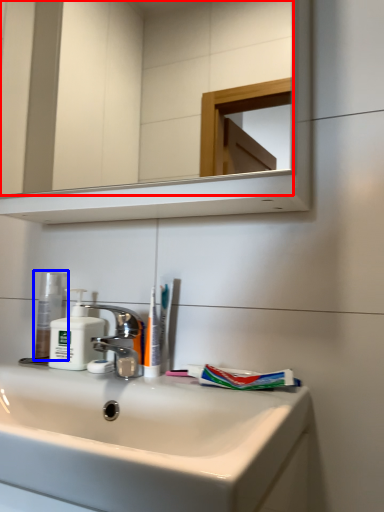
Question: Which object is closer to the camera taking this photo, mirror (highlighted by a red box) or toiletry (highlighted by a blue box)?

Choices:
 (A) mirror
 (B) toiletry

Answer: (A)